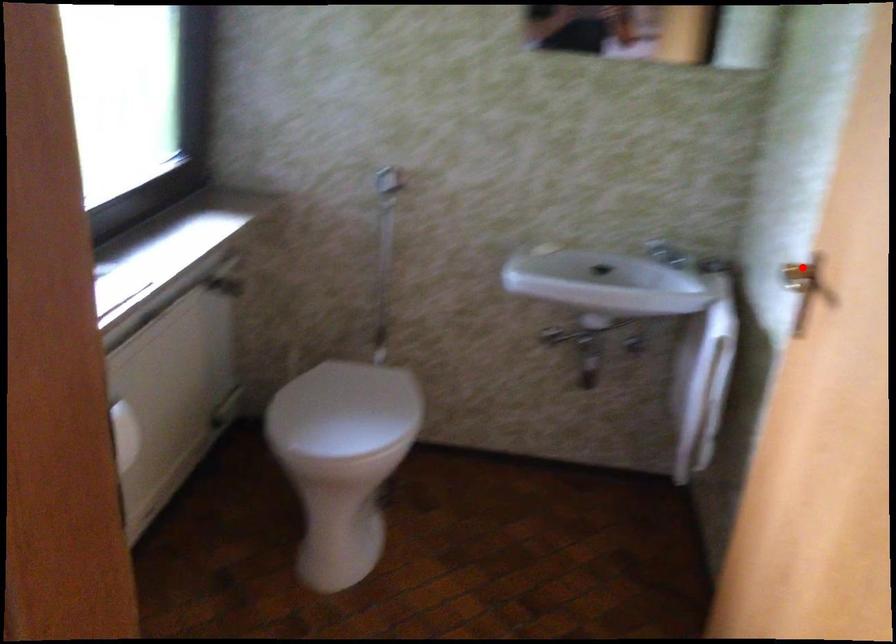
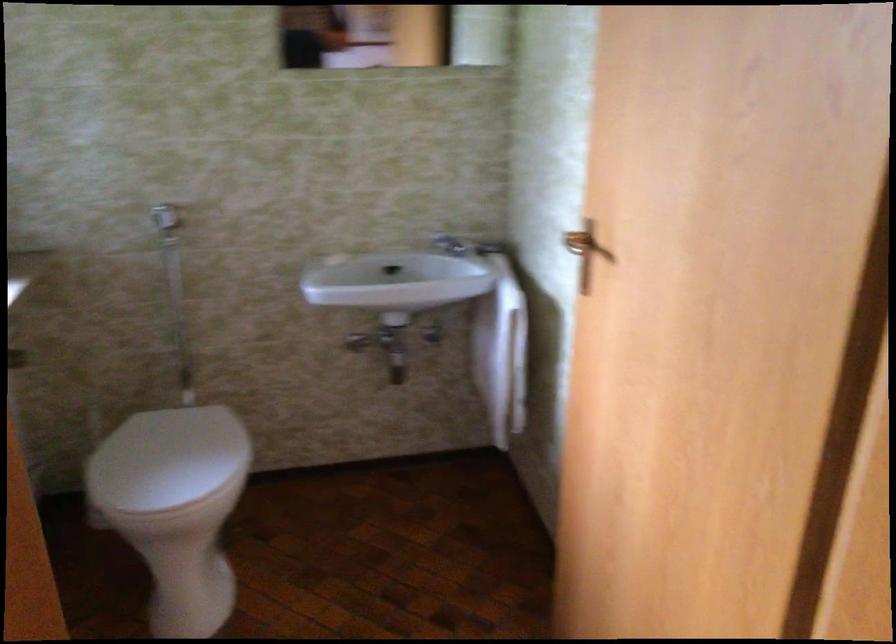
Question: I am providing you with two images of the same scene from different viewpoints. A red point is marked on the first image. At the location where the point appears in image 1, is it still visible in image 2?

Choices:
 (A) Yes
 (B) No

Answer: (A)